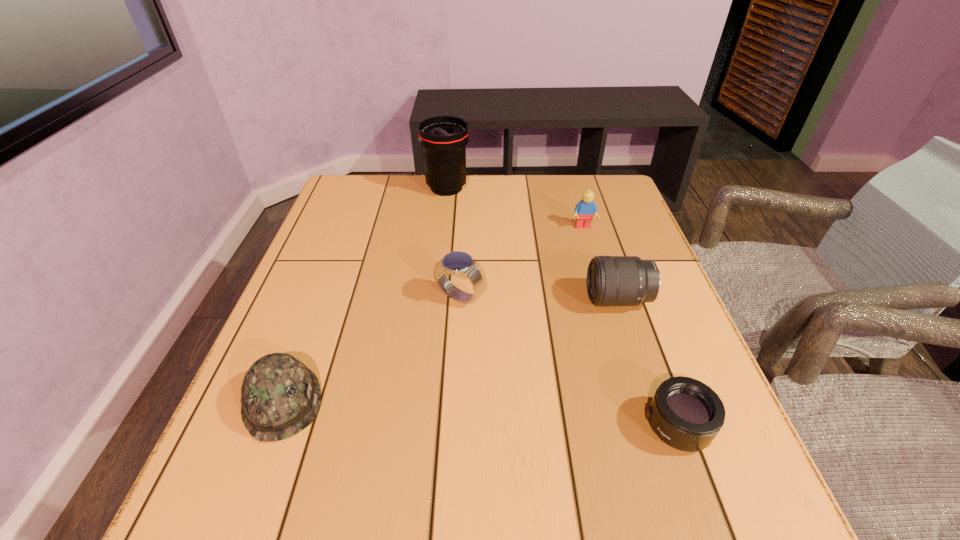
Locate an element on the screen. This screenshot has height=540, width=960. vacant point located between the second nearest telephoto lens and the watch is located at coordinates (539, 298).

I want to click on free space between the watch and the Lego, so click(x=521, y=261).

I want to click on free space between the shortest object and the watch, so click(x=568, y=361).

Find the location of a particular element. The height and width of the screenshot is (540, 960). free spot between the second tallest telephoto lens and the shortest object is located at coordinates (648, 363).

Identify the location of unoccupied position between the shortest telephoto lens and the Lego. The width and height of the screenshot is (960, 540). (630, 326).

Locate an element on the screen. This screenshot has height=540, width=960. empty location between the shortest telephoto lens and the second shortest telephoto lens is located at coordinates (648, 363).

This screenshot has height=540, width=960. I want to click on empty location between the leftmost telephoto lens and the watch, so point(453,242).

Identify the location of object that is the fourth nearest to the fifth nearest object. This screenshot has height=540, width=960. (686, 414).

Where is `object that stands as the fifth closest to the Lego`? The height and width of the screenshot is (540, 960). object that stands as the fifth closest to the Lego is located at coordinates (280, 396).

Find the location of `telephoto lens that stands as the closest to the headwear`. telephoto lens that stands as the closest to the headwear is located at coordinates (611, 280).